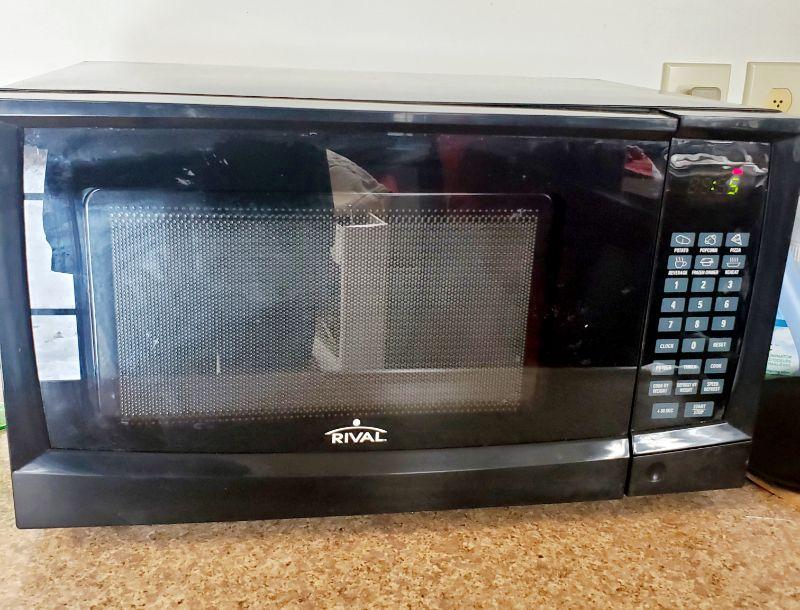
The height and width of the screenshot is (610, 800). I want to click on screen, so click(420, 273).